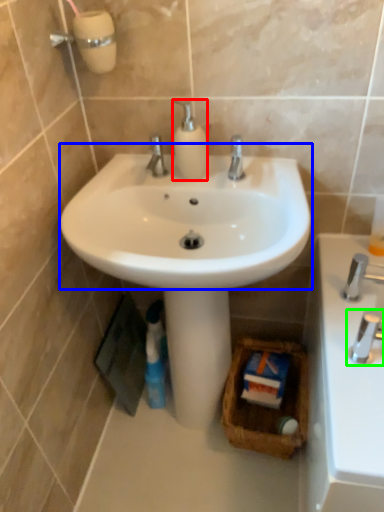
Question: Estimate the real-world distances between objects in this image. Which object is farther from soap dispenser (highlighted by a red box), sink (highlighted by a blue box) or tap (highlighted by a green box)?

Choices:
 (A) sink
 (B) tap

Answer: (B)